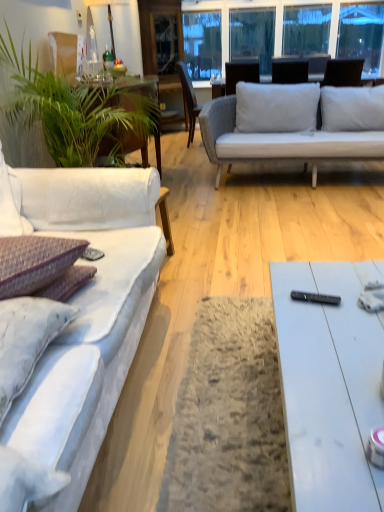
In the scene shown: Measure the distance between point (0, 308) and camera.

The distance of point (0, 308) from camera is 3.41 feet.

You are a GUI agent. You are given a task and a screenshot of the screen. Output one action in this format:
    pyautogui.click(x=<x>, y=<y>)
    Task: Click on the black plastic remote control at center
    Image resolution: width=384 pixels, height=512 pixels.
    Given the screenshot: What is the action you would take?
    pyautogui.click(x=315, y=298)

Image resolution: width=384 pixels, height=512 pixels. I want to click on white glossy coffee table at lower right, so tap(328, 388).

Image resolution: width=384 pixels, height=512 pixels. What do you see at coordinates (188, 100) in the screenshot? I see `light brown wooden chair at center` at bounding box center [188, 100].

Where is `transparent glass window screen at upper center`? Image resolution: width=384 pixels, height=512 pixels. transparent glass window screen at upper center is located at coordinates (296, 30).

The image size is (384, 512). In order to click on purple textured pillow at left in this screenshot , I will do pyautogui.click(x=26, y=340).

Consider the image. How many degrees apart are the facing directions of white glossy coffee table at lower right and purple textured pillow at left?

They differ by 86.6 degrees in their facing directions.

Considering the positions of objects white glossy coffee table at lower right and purple textured pillow at left in the image provided, who is more to the left, white glossy coffee table at lower right or purple textured pillow at left?

purple textured pillow at left.

From a real-world perspective, is white glossy coffee table at lower right physically located above or below purple textured pillow at left?

Clearly, from a real-world perspective, white glossy coffee table at lower right is below purple textured pillow at left.

From the image's perspective, does light brown wooden chair at center appear lower than green leafy plant at left?

Incorrect, from the image's perspective, light brown wooden chair at center is higher than green leafy plant at left.

Which is farther from the camera, (x=192, y=91) or (x=62, y=74)?

The point (x=192, y=91) is behind.

Which of these two, light brown wooden chair at center or green leafy plant at left, is bigger?

green leafy plant at left is bigger.

In the image, is light brown wooden chair at center on the left side or the right side of green leafy plant at left?

light brown wooden chair at center is positioned on green leafy plant at left's right side.

How different are the orientations of light brown wooden chair at center and black plastic remote control at center in degrees?

11.1 degrees separate the facing orientations of light brown wooden chair at center and black plastic remote control at center.

Considering the relative sizes of light brown wooden chair at center and black plastic remote control at center in the image provided, is light brown wooden chair at center thinner than black plastic remote control at center?

In fact, light brown wooden chair at center might be wider than black plastic remote control at center.

From the image's perspective, is light brown wooden chair at center above black plastic remote control at center?

Yes.

Is light brown wooden chair at center taller or shorter than black plastic remote control at center?

light brown wooden chair at center is taller than black plastic remote control at center.

Would you say white glossy coffee table at lower right is to the left or to the right of black plastic remote control at center in the picture?

white glossy coffee table at lower right is to the right of black plastic remote control at center.

Considering the relative sizes of white glossy coffee table at lower right and black plastic remote control at center in the image provided, is white glossy coffee table at lower right shorter than black plastic remote control at center?

No.

Does white glossy coffee table at lower right lie behind black plastic remote control at center?

That is False.

Consider the image. Is green leafy plant at left facing towards purple textured pillow at left?

No, green leafy plant at left is not aimed at purple textured pillow at left.

Is green leafy plant at left positioned in front of purple textured pillow at left?

No, green leafy plant at left is further to the viewer.

From a real-world perspective, which is physically above, green leafy plant at left or purple textured pillow at left?

green leafy plant at left, from a real-world perspective.

From the image's perspective, is green leafy plant at left located above or below purple textured pillow at left?

green leafy plant at left is above purple textured pillow at left.

Looking at this image, looking at their sizes, would you say purple textured pillow at left is wider or thinner than white glossy coffee table at lower right?

In the image, purple textured pillow at left appears to be more narrow than white glossy coffee table at lower right.

In order to click on coffee table on the right of purple textured pillow at left in this screenshot , I will do `click(328, 388)`.

What's the angular difference between purple textured pillow at left and white glossy coffee table at lower right's facing directions?

The facing directions of purple textured pillow at left and white glossy coffee table at lower right are 86.6 degrees apart.

Does purple textured pillow at left touch white glossy coffee table at lower right?

No, purple textured pillow at left is not in contact with white glossy coffee table at lower right.

Considering the relative sizes of white glossy coffee table at lower right and green leafy plant at left in the image provided, is white glossy coffee table at lower right shorter than green leafy plant at left?

Indeed, white glossy coffee table at lower right has a lesser height compared to green leafy plant at left.

Which object is further away from the camera, white glossy coffee table at lower right or green leafy plant at left?

green leafy plant at left is behind.

Considering the sizes of white glossy coffee table at lower right and green leafy plant at left in the image, is white glossy coffee table at lower right wider or thinner than green leafy plant at left?

white glossy coffee table at lower right is thinner than green leafy plant at left.

From the picture: Could you tell me if white glossy coffee table at lower right is facing green leafy plant at left?

No, white glossy coffee table at lower right does not turn towards green leafy plant at left.

You are a GUI agent. You are given a task and a screenshot of the screen. Output one action in this format:
    pyautogui.click(x=<x>, y=<y>)
    Task: Click on the coffee table below the purple textured pillow at left (from the image's perspective)
    
    Given the screenshot: What is the action you would take?
    pyautogui.click(x=328, y=388)

You are a GUI agent. You are given a task and a screenshot of the screen. Output one action in this format:
    pyautogui.click(x=<x>, y=<y>)
    Task: Click on the chair lying on the right of green leafy plant at left
    The image size is (384, 512).
    Given the screenshot: What is the action you would take?
    pyautogui.click(x=188, y=100)

Which object lies nearer to the anchor point transparent glass window screen at upper center, green leafy plant at left or light brown wooden chair at center?

light brown wooden chair at center.

Estimate the real-world distances between objects in this image. Which object is further from white glossy coffee table at lower right, green leafy plant at left or light brown wooden chair at center?

light brown wooden chair at center.

Which object lies further to the anchor point purple textured pillow at left, green leafy plant at left or light brown wooden chair at center?

Among the two, light brown wooden chair at center is located further to purple textured pillow at left.

Which object lies nearer to the anchor point purple textured pillow at left, transparent glass window screen at upper center or black plastic remote control at center?

black plastic remote control at center.

Looking at the image, which one is located closer to green leafy plant at left, black plastic remote control at center or purple textured pillow at left?

The object closer to green leafy plant at left is purple textured pillow at left.

Considering their positions, is light brown wooden chair at center positioned closer to black plastic remote control at center than transparent glass window screen at upper center?

light brown wooden chair at center is closer to black plastic remote control at center.

Based on their spatial positions, is purple textured pillow at left or green leafy plant at left further from white glossy coffee table at lower right?

green leafy plant at left is positioned further to the anchor white glossy coffee table at lower right.

Considering their positions, is light brown wooden chair at center positioned closer to purple textured pillow at left than transparent glass window screen at upper center?

light brown wooden chair at center.

Find the location of a particular element. Image resolution: width=384 pixels, height=512 pixels. houseplant between white glossy coffee table at lower right and transparent glass window screen at upper center from front to back is located at coordinates (75, 111).

Locate an element on the screen. This screenshot has width=384, height=512. chair positioned between white glossy coffee table at lower right and transparent glass window screen at upper center from near to far is located at coordinates (188, 100).

The image size is (384, 512). In order to click on remote control between white glossy coffee table at lower right and light brown wooden chair at center along the z-axis in this screenshot , I will do `click(315, 298)`.

The width and height of the screenshot is (384, 512). What are the coordinates of `chair positioned between green leafy plant at left and transparent glass window screen at upper center from near to far` in the screenshot? It's located at (188, 100).